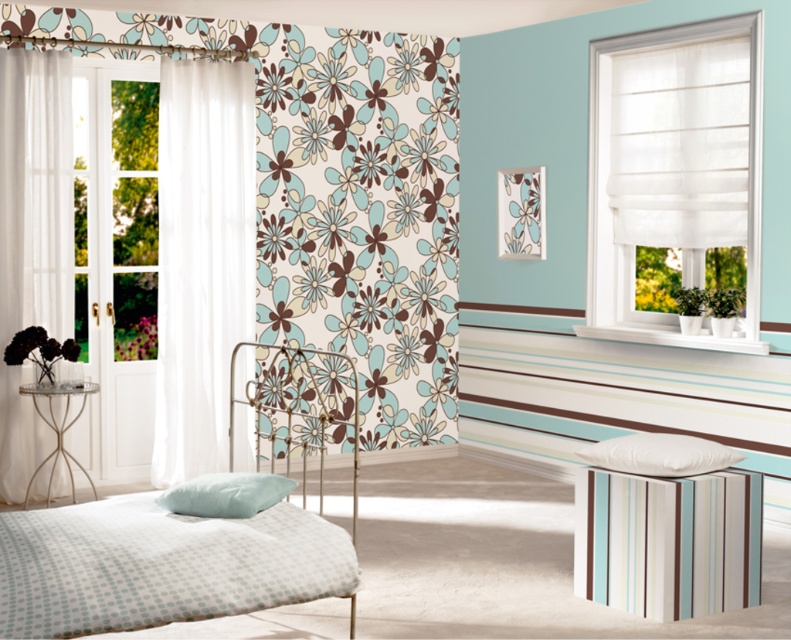
Question: Estimate the real-world distances between objects in this image. Which object is closer to the striped fabric stool at lower right?

Choices:
 (A) white sheer curtain at right
 (B) satin soft pillow at lower left
 (C) white dotted fabric bed at left
 (D) white sheer curtain at left

Answer: (C)

Question: Can you confirm if white sheer curtain at left is wider than white soft pillow at lower right?

Choices:
 (A) yes
 (B) no

Answer: (B)

Question: Does white dotted fabric bed at left have a lesser width compared to sheer white curtain at left?

Choices:
 (A) no
 (B) yes

Answer: (A)

Question: Is white sheer curtain at left to the left of striped fabric stool at lower right from the viewer's perspective?

Choices:
 (A) yes
 (B) no

Answer: (A)

Question: Which object appears farthest from the camera in this image?

Choices:
 (A) striped fabric stool at lower right
 (B) white soft pillow at lower right
 (C) white dotted fabric bed at left
 (D) white sheer curtain at left

Answer: (D)

Question: Which of these objects is positioned closest to the white soft pillow at lower right?

Choices:
 (A) striped fabric stool at lower right
 (B) satin soft pillow at lower left
 (C) white dotted fabric bed at left
 (D) white sheer curtain at right

Answer: (A)